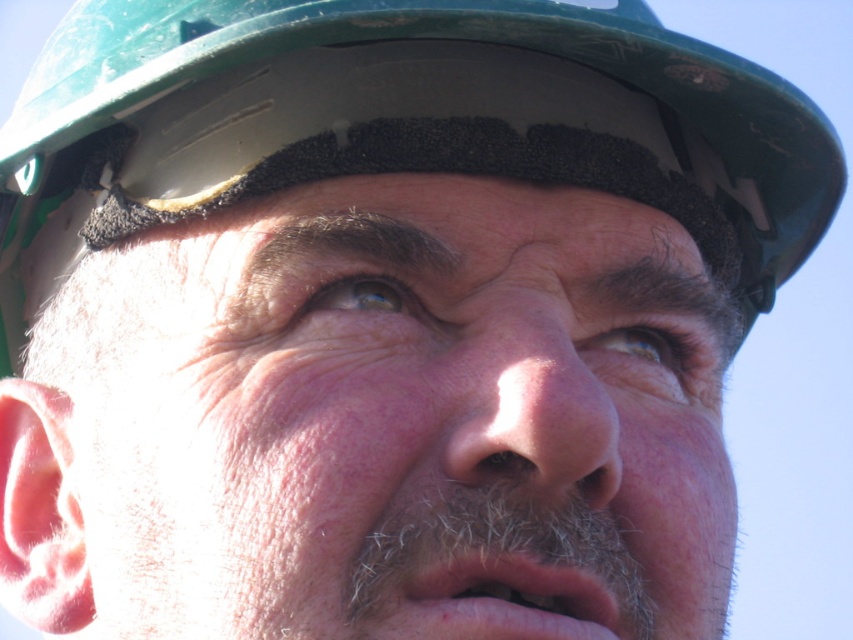
Who is positioned more to the right, dry skin at center or pink matte/natural skin at center?

Positioned to the right is pink matte/natural skin at center.

Is dry skin at center to the right of pink matte/natural skin at center from the viewer's perspective?

In fact, dry skin at center is to the left of pink matte/natural skin at center.

In order to click on dry skin at center in this screenshot , I will do `click(405, 417)`.

Who is higher up, green matte hard hat at upper center or pink matte/natural skin at center?

Positioned higher is green matte hard hat at upper center.

Image resolution: width=853 pixels, height=640 pixels. What do you see at coordinates (402, 129) in the screenshot?
I see `green matte hard hat at upper center` at bounding box center [402, 129].

At what (x,y) coordinates should I click in order to perform the action: click on green matte hard hat at upper center. Please return your answer as a coordinate pair (x, y). This screenshot has height=640, width=853. Looking at the image, I should click on (402, 129).

Does green matte hard hat at upper center lie in front of gray fuzzy beard at lower center?

No, it is not.

Between green matte hard hat at upper center and gray fuzzy beard at lower center, which one is positioned higher?

green matte hard hat at upper center

Identify the location of green matte hard hat at upper center. (402, 129).

This screenshot has width=853, height=640. I want to click on green matte hard hat at upper center, so click(x=402, y=129).